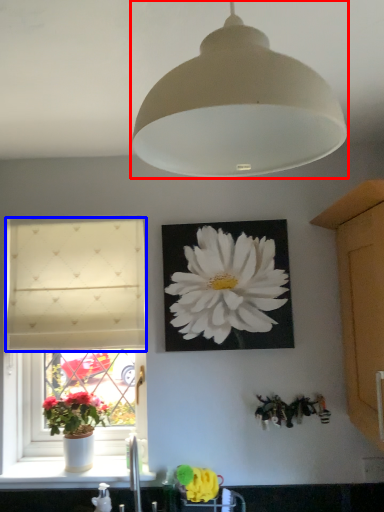
Question: Among these objects, which one is nearest to the camera, lamp (highlighted by a red box) or curtain (highlighted by a blue box)?

Choices:
 (A) lamp
 (B) curtain

Answer: (A)